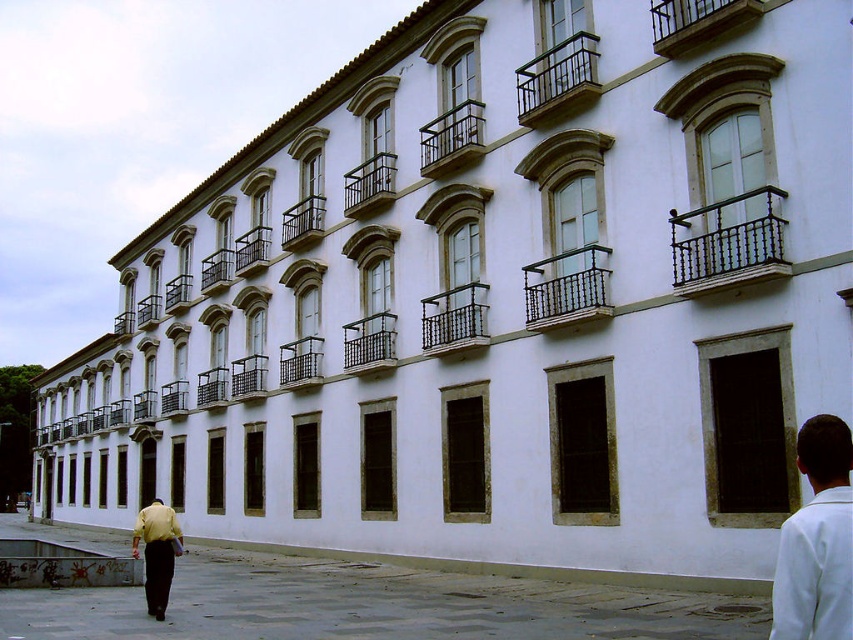
Question: Among these points, which one is farthest from the camera?

Choices:
 (A) (776, 612)
 (B) (160, 529)

Answer: (B)

Question: Does white matte shirt at lower right appear under yellow shirt at lower left?

Choices:
 (A) yes
 (B) no

Answer: (B)

Question: Is white matte shirt at lower right closer to the viewer compared to yellow shirt at lower left?

Choices:
 (A) yes
 (B) no

Answer: (A)

Question: In this image, where is white matte shirt at lower right located relative to yellow shirt at lower left?

Choices:
 (A) left
 (B) right

Answer: (B)

Question: Which object appears farthest from the camera in this image?

Choices:
 (A) yellow shirt at lower left
 (B) white matte shirt at lower right

Answer: (A)